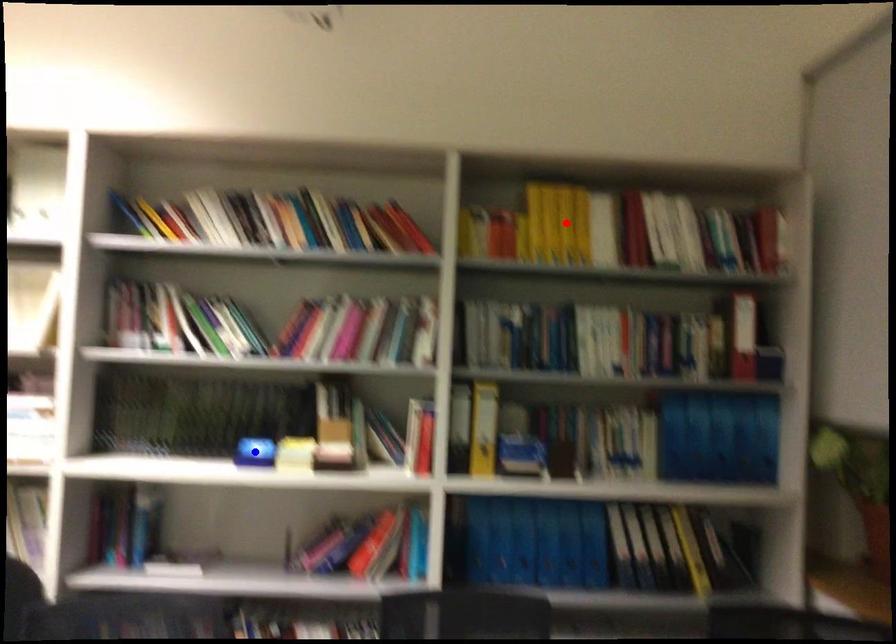
Question: In the image, two points are highlighted. Which point is nearer to the camera? Reply with the corresponding letter.

Choices:
 (A) blue point
 (B) red point

Answer: (A)